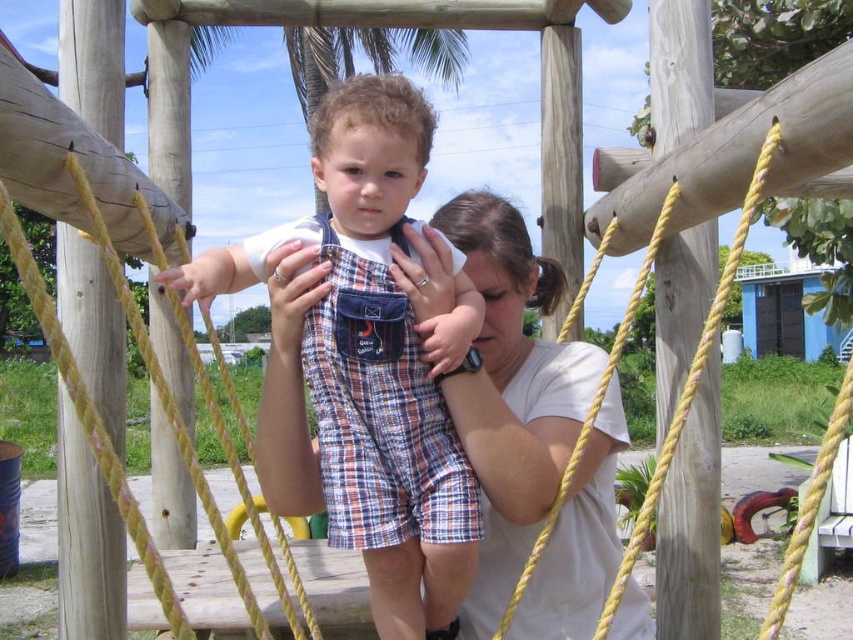
Question: Which point is closer to the camera?

Choices:
 (A) plaid cotton overalls at center
 (B) plaid fabric overalls at center

Answer: (A)

Question: Estimate the real-world distances between objects in this image. Which object is farther from the plaid fabric overalls at center?

Choices:
 (A) white cotton shirt at center
 (B) plaid cotton overalls at center

Answer: (A)

Question: Does plaid cotton overalls at center appear under plaid fabric overalls at center?

Choices:
 (A) no
 (B) yes

Answer: (B)

Question: Which of the following is the closest to the observer?

Choices:
 (A) (469, 320)
 (B) (560, 474)

Answer: (A)

Question: Is plaid cotton overalls at center further to camera compared to plaid fabric overalls at center?

Choices:
 (A) yes
 (B) no

Answer: (B)

Question: Can you confirm if plaid cotton overalls at center is thinner than plaid fabric overalls at center?

Choices:
 (A) yes
 (B) no

Answer: (B)